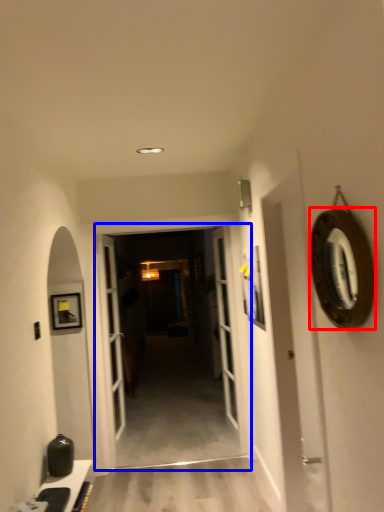
Question: Which object is closer to the camera taking this photo, oval (highlighted by a red box) or garage door (highlighted by a blue box)?

Choices:
 (A) oval
 (B) garage door

Answer: (A)